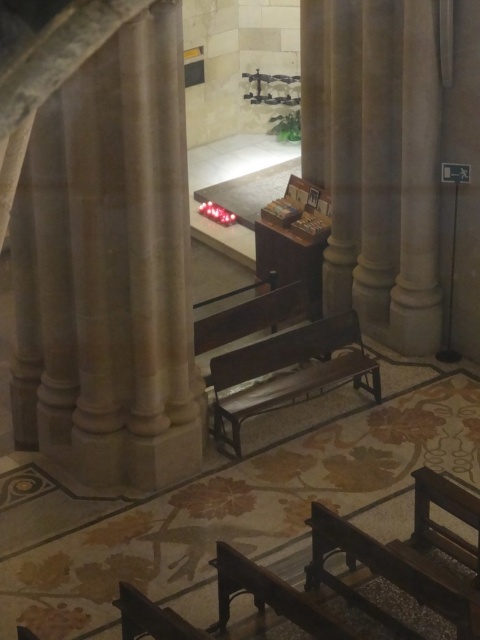
Question: Which point appears farthest from the camera in this image?

Choices:
 (A) (292, 394)
 (B) (24, 403)

Answer: (A)

Question: Can you confirm if beige stone pillar at left is positioned above wooden bench at center?

Choices:
 (A) yes
 (B) no

Answer: (A)

Question: Is beige stone pillar at left above wooden bench at center?

Choices:
 (A) yes
 (B) no

Answer: (A)

Question: Is beige stone pillar at left smaller than wooden bench at center?

Choices:
 (A) no
 (B) yes

Answer: (A)

Question: Among these objects, which one is farthest from the camera?

Choices:
 (A) beige stone pillar at left
 (B) wooden bench at center

Answer: (B)